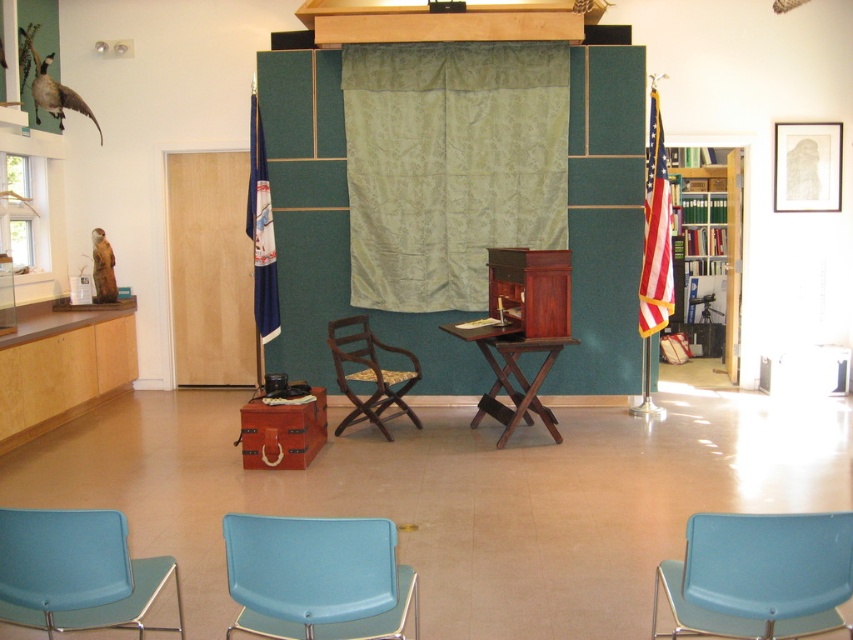
Question: Which of these objects is positioned closest to the green velvet curtain at center?

Choices:
 (A) wooden chair with woven seat at center
 (B) blue fabric curtain at center
 (C) light blue plastic chair at lower center
 (D) wooden folding table at center

Answer: (A)

Question: Among these objects, which one is nearest to the camera?

Choices:
 (A) matte blue chair at lower right
 (B) wooden chair with woven seat at center
 (C) light blue plastic chair at lower center

Answer: (A)

Question: Is matte blue chair at lower right thinner than wooden folding table at center?

Choices:
 (A) no
 (B) yes

Answer: (B)

Question: Which of the following is the closest to the observer?

Choices:
 (A) light blue plastic chair at lower center
 (B) wooden folding table at center
 (C) matte blue chair at lower right
 (D) green velvet curtain at center

Answer: (C)

Question: Is light blue plastic chair at lower center wider than blue fabric curtain at center?

Choices:
 (A) no
 (B) yes

Answer: (B)

Question: Is matte blue chair at lower left above wooden folding table at center?

Choices:
 (A) no
 (B) yes

Answer: (A)